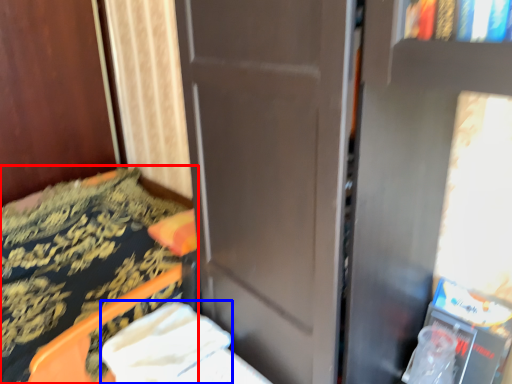
Question: Among these objects, which one is farthest to the camera, furniture (highlighted by a red box) or sheet (highlighted by a blue box)?

Choices:
 (A) furniture
 (B) sheet

Answer: (B)